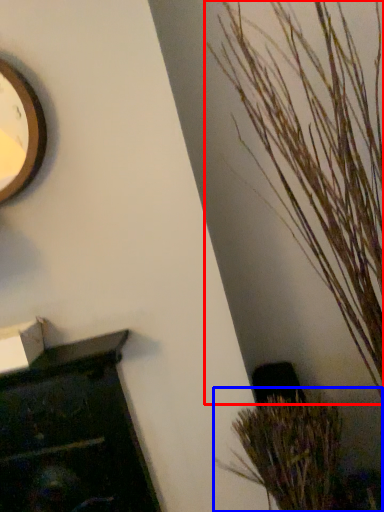
Question: Which object is closer to the camera taking this photo, houseplant (highlighted by a red box) or houseplant (highlighted by a blue box)?

Choices:
 (A) houseplant
 (B) houseplant

Answer: (A)